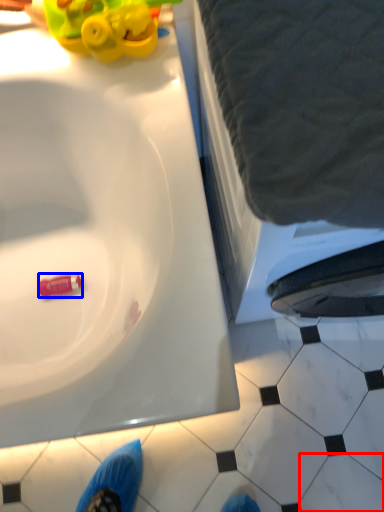
Question: Which point is closer to the camera, tile (highlighted by a red box) or toy (highlighted by a blue box)?

Choices:
 (A) tile
 (B) toy

Answer: (A)